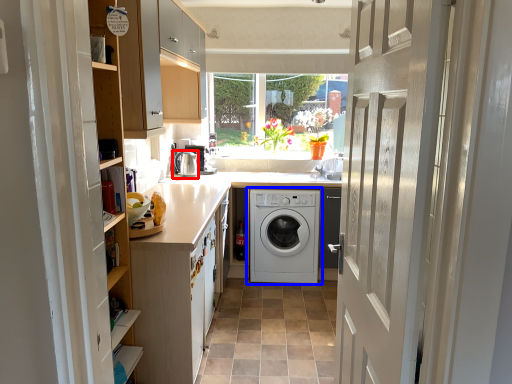
Question: Which point is closer to the camera, water heater (highlighted by a red box) or washing machine (highlighted by a blue box)?

Choices:
 (A) water heater
 (B) washing machine

Answer: (B)